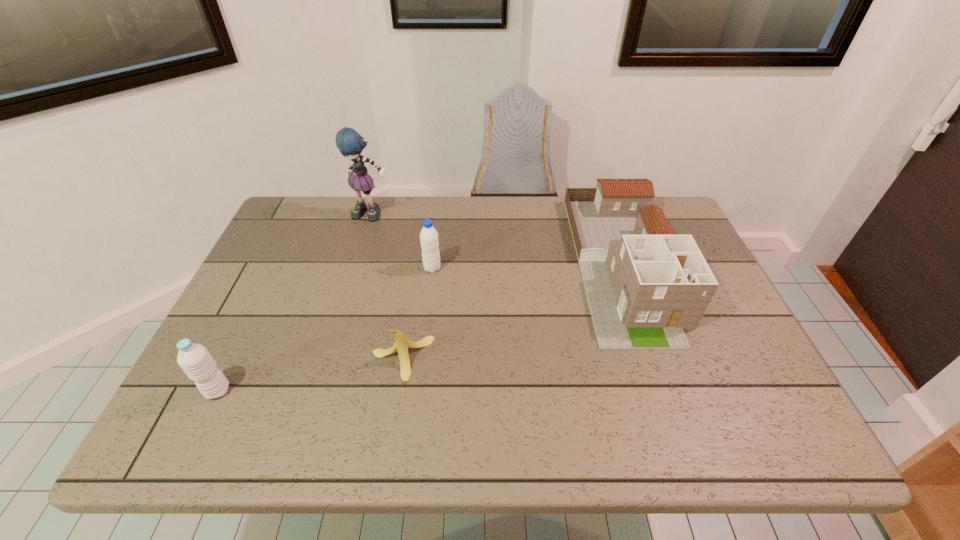
Image resolution: width=960 pixels, height=540 pixels. What are the coordinates of `the second object from left to right` in the screenshot? It's located at (350, 143).

Locate an element on the screen. This screenshot has height=540, width=960. the tallest object is located at coordinates point(350,143).

What are the coordinates of `the second tallest object` in the screenshot? It's located at tap(644, 284).

Identify the location of dollhouse. The image size is (960, 540). pos(644,284).

At what (x,y) coordinates should I click in order to perform the action: click on the left water bottle. Please return your answer as a coordinate pair (x, y). The height and width of the screenshot is (540, 960). Looking at the image, I should click on (195, 360).

Where is `the nearer water bottle`? the nearer water bottle is located at coordinates (195, 360).

Where is `the right water bottle`? Image resolution: width=960 pixels, height=540 pixels. the right water bottle is located at coordinates (429, 241).

Where is `the shortest object`? This screenshot has width=960, height=540. the shortest object is located at coordinates (401, 344).

At what (x,y) coordinates should I click in order to perform the action: click on free point located 0.050m on the front-facing side of the fourth object from right to left. Please return your answer as a coordinate pair (x, y). The height and width of the screenshot is (540, 960). Looking at the image, I should click on click(368, 233).

Where is `vacant region located at the main entrance of the rightmost object`? Image resolution: width=960 pixels, height=540 pixels. vacant region located at the main entrance of the rightmost object is located at coordinates (661, 375).